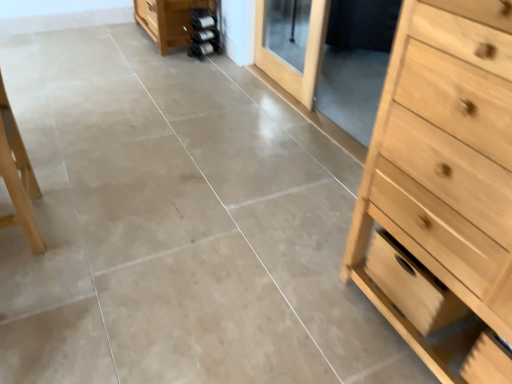
Question: Considering the positions of light brown wooden screen door at upper center and light wood chest of drawers at right in the image, is light brown wooden screen door at upper center wider or thinner than light wood chest of drawers at right?

Choices:
 (A) thin
 (B) wide

Answer: (A)

Question: From their relative heights in the image, would you say light brown wooden screen door at upper center is taller or shorter than light wood chest of drawers at right?

Choices:
 (A) tall
 (B) short

Answer: (B)

Question: Which object is positioned closest to the light wood drawer at right?

Choices:
 (A) light brown wooden screen door at upper center
 (B) light wood chest of drawers at right

Answer: (B)

Question: Considering the real-world distances, which object is farthest from the light wood drawer at right?

Choices:
 (A) light wood chest of drawers at right
 (B) light brown wooden screen door at upper center

Answer: (B)